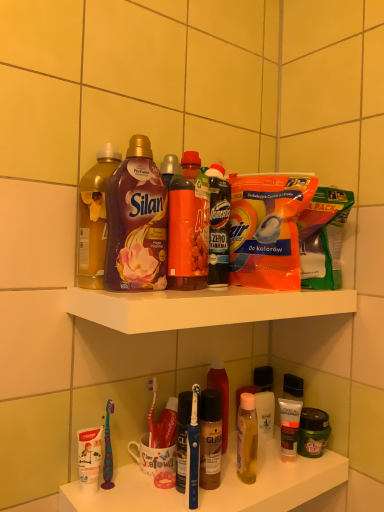
This screenshot has height=512, width=384. In order to click on free region under orange plastic packet at upper center (from a real-world perspective) in this screenshot , I will do `click(274, 288)`.